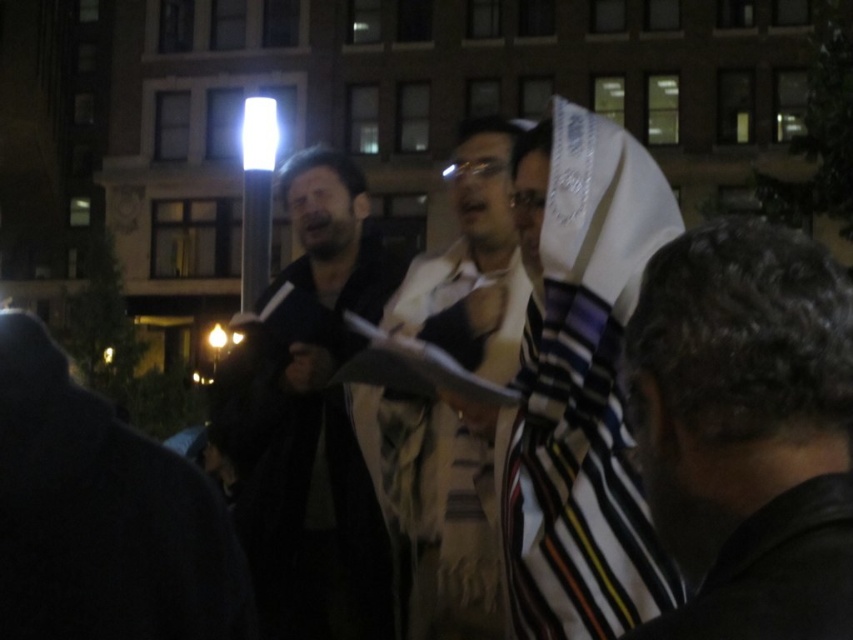
Between dark matte jacket at center and white textured scarf at center, which one appears on the right side from the viewer's perspective?

white textured scarf at center

Who is more forward, (270,380) or (492,506)?

Point (492,506) is more forward.

Between point (306, 362) and point (396, 506), which one is positioned in front?

Point (396, 506) is in front.

Where is `dark matte jacket at center`? The width and height of the screenshot is (853, 640). dark matte jacket at center is located at coordinates (302, 493).

Does dark curly hair at lower right have a greater height compared to white textured scarf at center?

In fact, dark curly hair at lower right may be shorter than white textured scarf at center.

Does point (849, 516) come farther from viewer compared to point (399, 422)?

No.

Locate an element on the screen. dark curly hair at lower right is located at coordinates (746, 429).

Which is behind, point (694, 260) or point (299, 576)?

Point (299, 576)

Locate an element on the screen. This screenshot has height=640, width=853. dark curly hair at lower right is located at coordinates (746, 429).

Where is `dark curly hair at lower right`? dark curly hair at lower right is located at coordinates (746, 429).